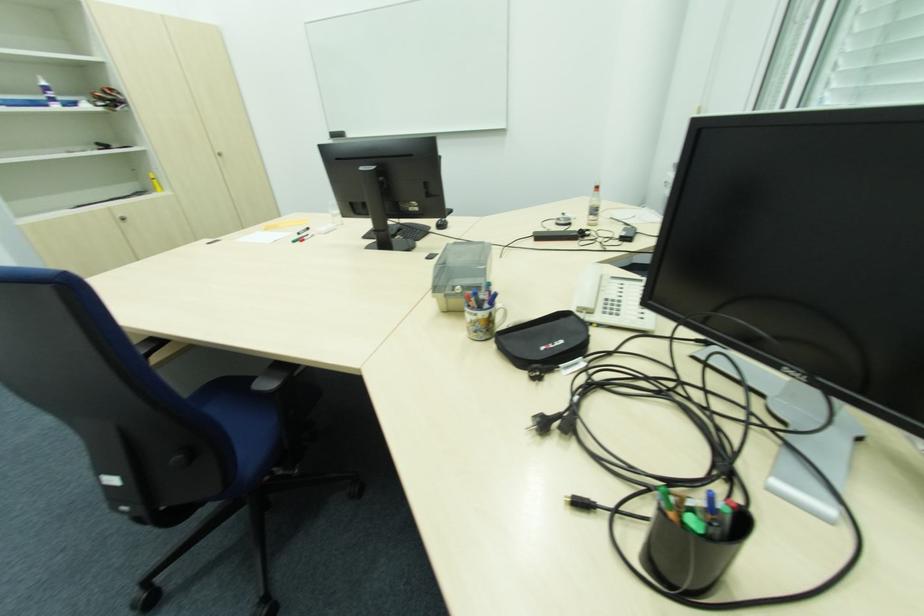
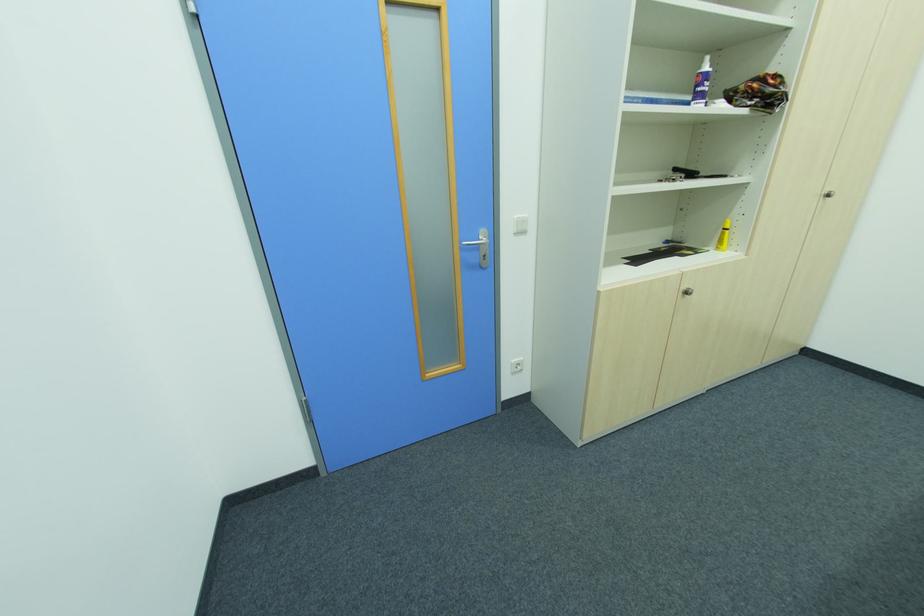
Locate, in the second image, the point that corresponds to the point at 221,156 in the first image.

(822, 198)